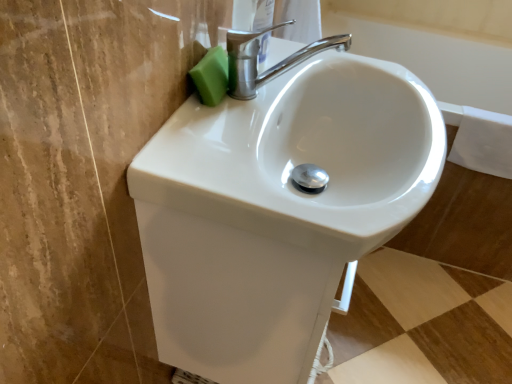
Question: Can you confirm if white glossy sink at center is positioned to the left of polished chrome faucet at upper center?

Choices:
 (A) no
 (B) yes

Answer: (B)

Question: Could polished chrome faucet at upper center be considered to be inside white glossy sink at center?

Choices:
 (A) no
 (B) yes

Answer: (A)

Question: Does white glossy sink at center have a lesser height compared to polished chrome faucet at upper center?

Choices:
 (A) no
 (B) yes

Answer: (B)

Question: From the image's perspective, is white glossy sink at center on top of polished chrome faucet at upper center?

Choices:
 (A) no
 (B) yes

Answer: (A)

Question: From a real-world perspective, is white glossy sink at center under polished chrome faucet at upper center?

Choices:
 (A) yes
 (B) no

Answer: (A)

Question: Does white glossy sink at center have a greater height compared to polished chrome faucet at upper center?

Choices:
 (A) yes
 (B) no

Answer: (B)

Question: Is there a large distance between green sponge at upper left and white glossy sink at center?

Choices:
 (A) yes
 (B) no

Answer: (B)

Question: Can you confirm if green sponge at upper left is thinner than white glossy sink at center?

Choices:
 (A) yes
 (B) no

Answer: (A)

Question: From the image's perspective, does green sponge at upper left appear lower than white glossy sink at center?

Choices:
 (A) no
 (B) yes

Answer: (A)

Question: Does green sponge at upper left appear on the left side of white glossy sink at center?

Choices:
 (A) no
 (B) yes

Answer: (B)

Question: From a real-world perspective, does green sponge at upper left stand above white glossy sink at center?

Choices:
 (A) no
 (B) yes

Answer: (B)

Question: Can you confirm if green sponge at upper left is smaller than white glossy sink at center?

Choices:
 (A) yes
 (B) no

Answer: (A)

Question: Considering the relative sizes of green sponge at upper left and polished chrome faucet at upper center in the image provided, is green sponge at upper left bigger than polished chrome faucet at upper center?

Choices:
 (A) no
 (B) yes

Answer: (A)